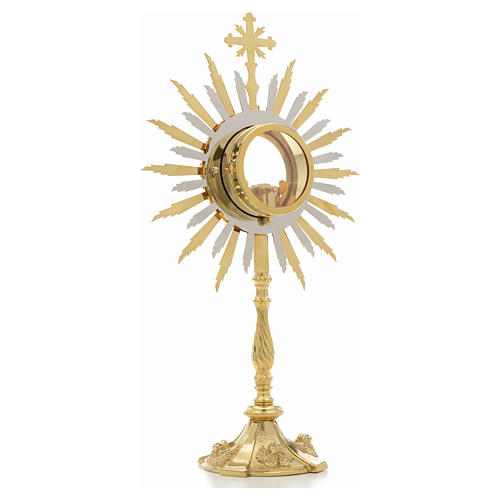
Find the location of `corner`. corner is located at coordinates (248, 53).